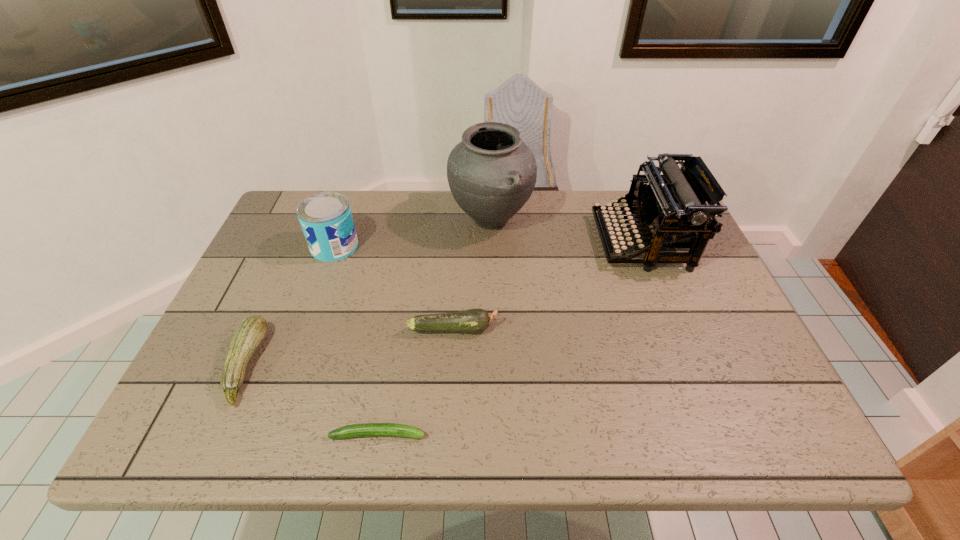
At what (x,y) coordinates should I click in order to perform the action: click on the tallest object. Please return your answer as a coordinate pair (x, y). Looking at the image, I should click on (492, 173).

This screenshot has width=960, height=540. What are the coordinates of `typewriter` in the screenshot? It's located at (671, 207).

This screenshot has height=540, width=960. I want to click on the fifth shortest object, so click(x=671, y=207).

Locate an element on the screen. This screenshot has height=540, width=960. can is located at coordinates (326, 220).

This screenshot has width=960, height=540. Identify the location of the third tallest object. (326, 220).

This screenshot has height=540, width=960. In order to click on the leftmost zucchini in this screenshot , I will do `click(250, 333)`.

At what (x,y) coordinates should I click in order to perform the action: click on the nearest zucchini. Please return your answer as a coordinate pair (x, y). This screenshot has height=540, width=960. Looking at the image, I should click on (366, 429).

Locate an element on the screen. The width and height of the screenshot is (960, 540). the shortest zucchini is located at coordinates (366, 429).

This screenshot has width=960, height=540. What are the coordinates of `vacant space situated on the left of the urn` in the screenshot? It's located at (394, 220).

Locate an element on the screen. vacant space located 0.140m on the typing side of the typewriter is located at coordinates (549, 242).